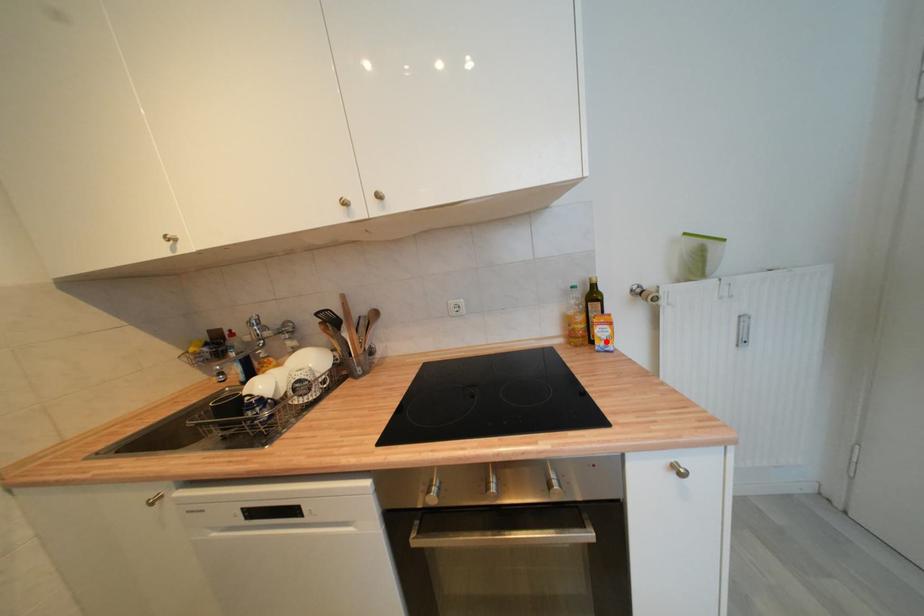
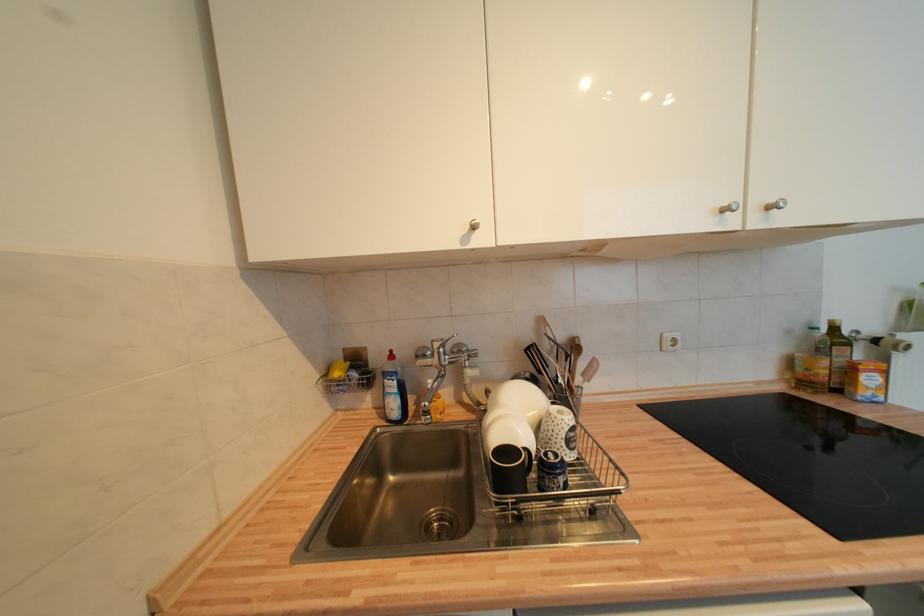
The point at the highlighted location is marked in the first image. Where is the corresponding point in the second image?

(873, 391)